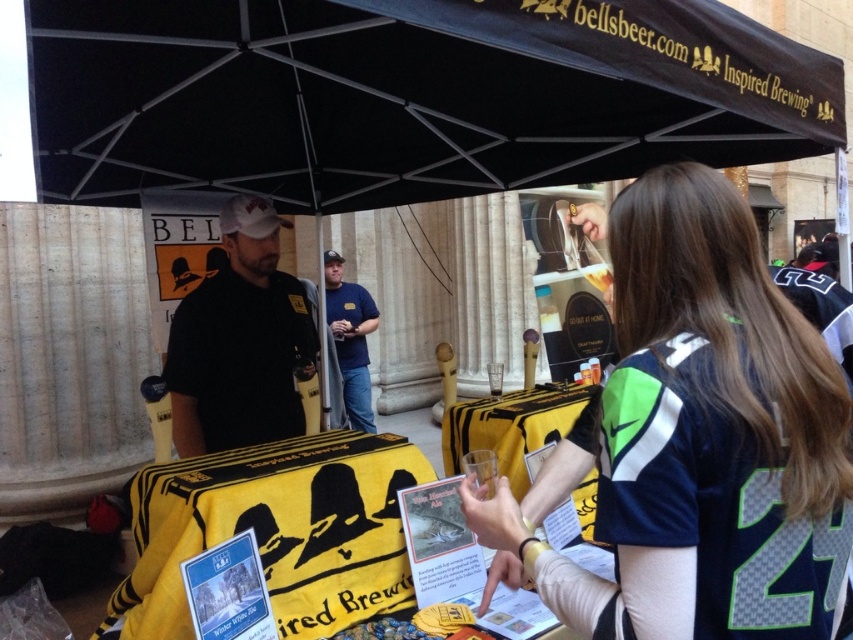
Question: Can you confirm if black matte shirt at center is wider than blue denim jeans at center?

Choices:
 (A) no
 (B) yes

Answer: (B)

Question: Among these objects, which one is farthest from the camera?

Choices:
 (A) black fabric canopy at upper center
 (B) blue denim jeans at center
 (C) black matte shirt at center
 (D) dark blue jersey at center

Answer: (B)

Question: Observing the image, what is the correct spatial positioning of black fabric canopy at upper center in reference to black matte shirt at center?

Choices:
 (A) above
 (B) below

Answer: (A)

Question: Estimate the real-world distances between objects in this image. Which object is farther from the black fabric umbrella at upper center?

Choices:
 (A) yellow fabric towel at center
 (B) dark blue jersey at center

Answer: (A)

Question: Can you confirm if black fabric canopy at upper center is positioned to the left of black matte shirt at center?

Choices:
 (A) yes
 (B) no

Answer: (B)

Question: Which object appears closest to the camera in this image?

Choices:
 (A) yellow fabric towel at center
 (B) black fabric umbrella at upper center

Answer: (B)